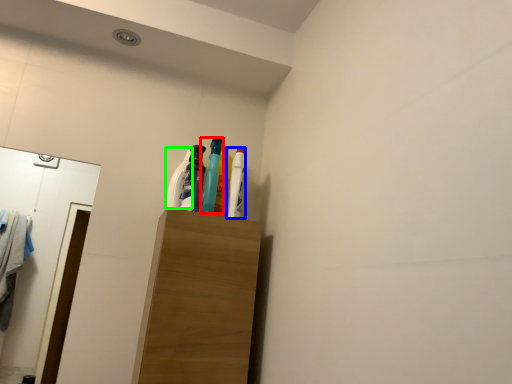
Question: Which object is positioned farthest from bottle (highlighted by a red box)? Select from bottle (highlighted by a blue box) and cleaning product (highlighted by a green box).

Choices:
 (A) bottle
 (B) cleaning product

Answer: (B)